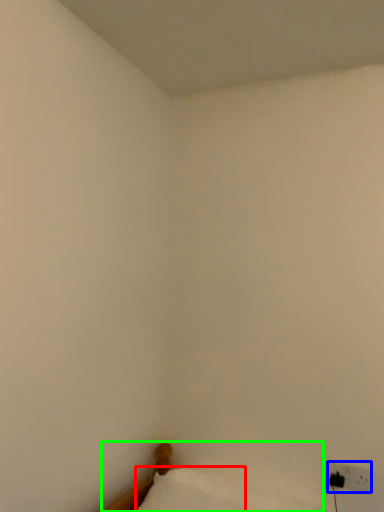
Question: Estimate the real-world distances between objects in this image. Which object is closer to pillow (highlighted by a red box), electric outlet (highlighted by a blue box) or furniture (highlighted by a green box)?

Choices:
 (A) electric outlet
 (B) furniture

Answer: (B)